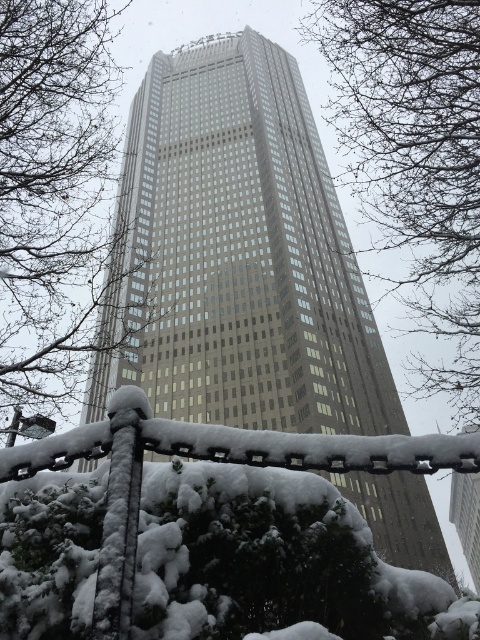
Does gray glass skyscraper at center have a lesser width compared to bare branches at center?

No, gray glass skyscraper at center is not thinner than bare branches at center.

I want to click on gray glass skyscraper at center, so click(237, 256).

Is point (456, 372) positioned in front of point (22, 68)?

No, (456, 372) is further to viewer.

Does bare branches at upper center have a greater height compared to bare branches at center?

Indeed, bare branches at upper center has a greater height compared to bare branches at center.

Measure the distance between point (361, 67) and camera.

They are 42.79 feet apart.

Where is `bare branches at upper center`? The width and height of the screenshot is (480, 640). bare branches at upper center is located at coordinates (415, 160).

At what (x,y) coordinates should I click in order to perform the action: click on snow-covered chain-link fence at lower center. Please return your answer as a coordinate pair (x, y). Looking at the image, I should click on (211, 536).

Consider the image. Does snow-covered chain-link fence at lower center appear on the right side of bare branches at upper center?

In fact, snow-covered chain-link fence at lower center is to the left of bare branches at upper center.

Between point (422, 588) and point (344, 36), which one is positioned behind?

Positioned behind is point (344, 36).

Find the location of a particular element. The width and height of the screenshot is (480, 640). snow-covered chain-link fence at lower center is located at coordinates (211, 536).